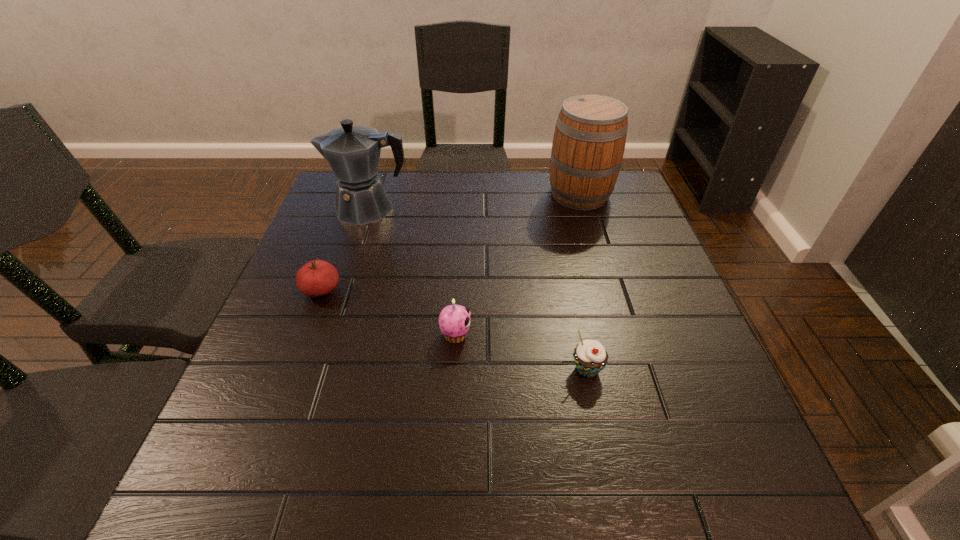
Identify the location of free space located 0.270m on the front of the tomato. (276, 414).

The width and height of the screenshot is (960, 540). In order to click on cider at the far edge in this screenshot , I will do `click(589, 140)`.

I want to click on coffeepot present at the far edge, so click(x=353, y=152).

Identify the location of coffeepot that is positioned at the left edge. The height and width of the screenshot is (540, 960). (353, 152).

Locate an element on the screen. This screenshot has width=960, height=540. tomato that is at the left edge is located at coordinates (316, 278).

The height and width of the screenshot is (540, 960). In order to click on object located at the right edge in this screenshot , I will do `click(589, 140)`.

The width and height of the screenshot is (960, 540). In order to click on object that is at the far left corner in this screenshot , I will do `click(353, 152)`.

Locate an element on the screen. The width and height of the screenshot is (960, 540). object positioned at the far right corner is located at coordinates pyautogui.click(x=589, y=140).

I want to click on vacant area at the far edge, so (431, 190).

Image resolution: width=960 pixels, height=540 pixels. In order to click on vacant space at the near edge of the desktop in this screenshot , I will do `click(376, 510)`.